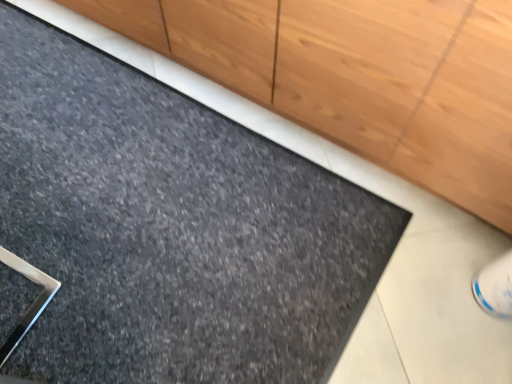
The height and width of the screenshot is (384, 512). What are the coordinates of `matte black mat at lower left` in the screenshot? It's located at (362, 79).

Measure the distance between matte black mat at lower left and camera.

25.48 inches.

Image resolution: width=512 pixels, height=384 pixels. What do you see at coordinates (362, 79) in the screenshot?
I see `matte black mat at lower left` at bounding box center [362, 79].

Identify the location of matte black mat at lower left. click(x=362, y=79).